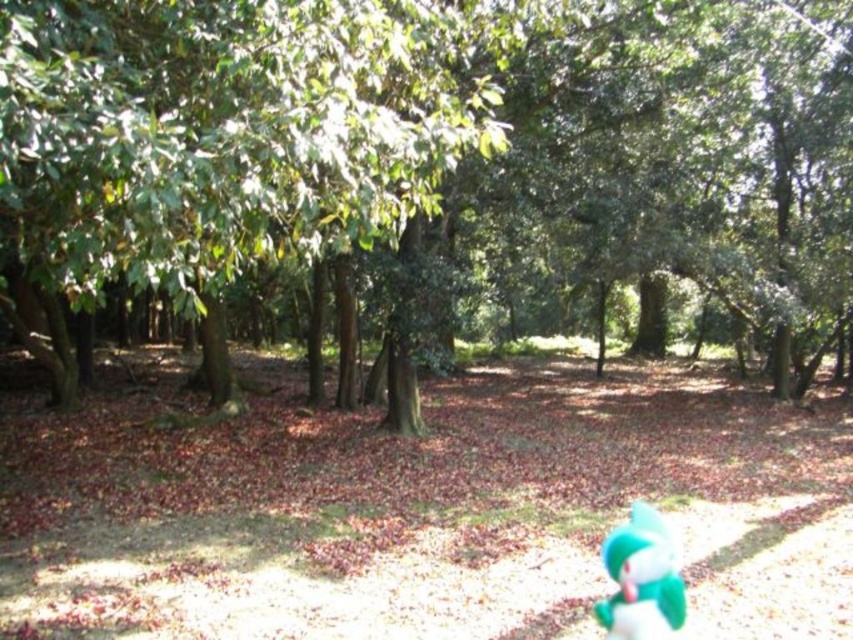
Question: Observing the image, what is the correct spatial positioning of green leafy tree at center in reference to teal plush toy at lower right?

Choices:
 (A) right
 (B) left

Answer: (B)

Question: Observing the image, what is the correct spatial positioning of green leafy tree at center in reference to teal plush toy at lower right?

Choices:
 (A) left
 (B) right

Answer: (A)

Question: Which object is farther from the camera taking this photo?

Choices:
 (A) green leafy tree at center
 (B) teal plush toy at lower right

Answer: (B)

Question: Which of the following is the closest to the observer?

Choices:
 (A) (621, 628)
 (B) (267, 145)

Answer: (B)

Question: Which point is farther to the camera?

Choices:
 (A) teal plush toy at lower right
 (B) green leafy tree at center

Answer: (A)

Question: Does green leafy tree at center have a larger size compared to teal plush toy at lower right?

Choices:
 (A) no
 (B) yes

Answer: (B)